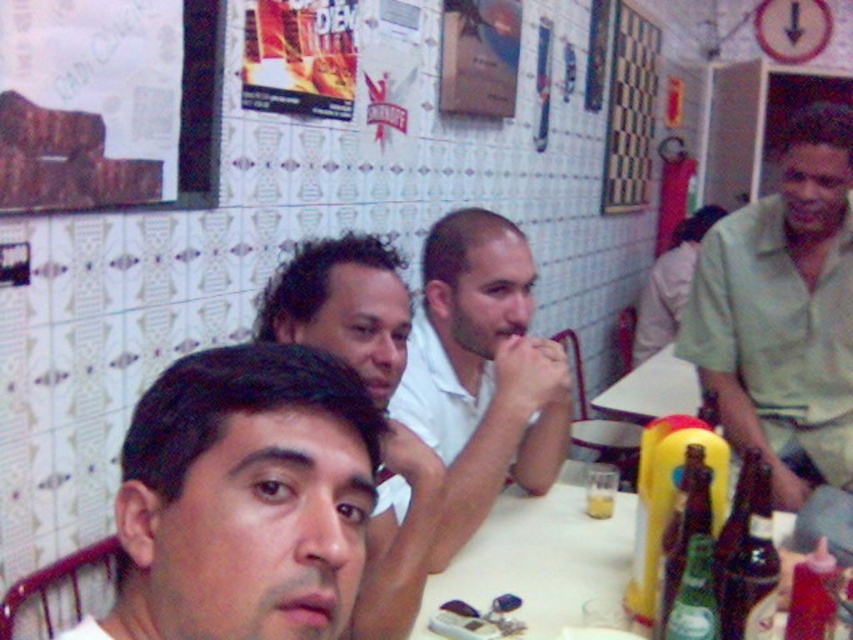
From the picture: You are a photographer trying to capture a clear shot of the smooth skin face at center and the white matte shirt at center. Which object will appear larger in your photo?

The smooth skin face at center will appear larger in the photo because it is closer to the viewer than the white matte shirt at center.

Where is the smooth skin face at center located in the image?

The smooth skin face at center is located at point 0.780 on the x axis and 0.285 on the y axis.

You are a customer sitting at the table and want to order a drink. You notice the green cotton shirt at right and the checkerboard pattern at upper right. Which object is closer to the ceiling?

The checkerboard pattern at upper right is closer to the ceiling because the green cotton shirt at right is positioned under it.